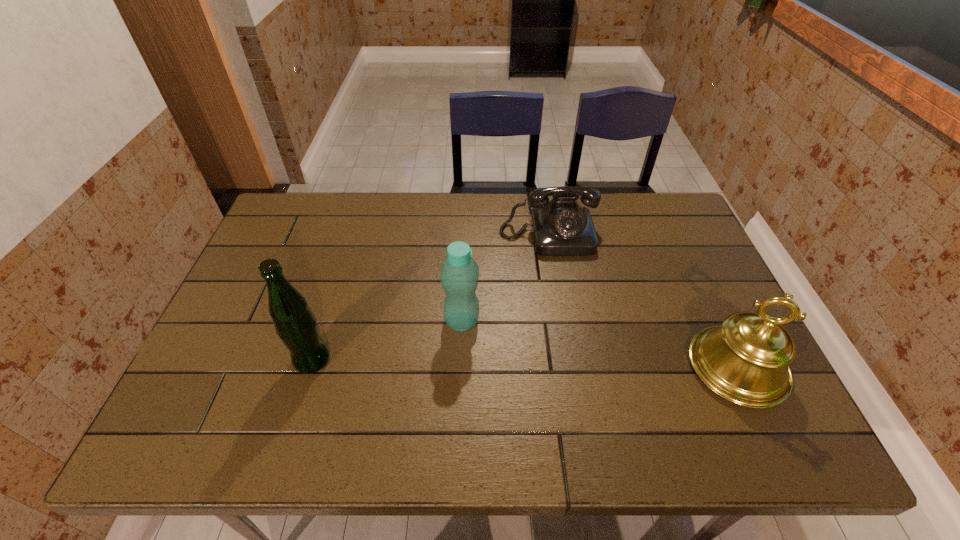
At what (x,y) coordinates should I click in order to perform the action: click on vacant space at the near edge of the desktop. Please return your answer as a coordinate pair (x, y). Looking at the image, I should click on (311, 373).

The image size is (960, 540). I want to click on free space at the left edge of the desktop, so click(245, 302).

In the image, there is a desktop. Identify the location of free space at the right edge. Image resolution: width=960 pixels, height=540 pixels. (698, 256).

At what (x,y) coordinates should I click in order to perform the action: click on free space at the near left corner. Please return your answer as a coordinate pair (x, y). Looking at the image, I should click on (252, 396).

I want to click on free space at the far right corner of the desktop, so click(641, 223).

I want to click on vacant space that's between the third object from left to right and the second object from left to right, so click(505, 278).

Identify the location of vacant area that lies between the bell and the farthest object. The image size is (960, 540). (642, 301).

The width and height of the screenshot is (960, 540). Identify the location of vacant space that's between the shortest object and the water bottle. (505, 278).

I want to click on vacant space in between the third object from right to left and the bell, so click(x=600, y=344).

This screenshot has height=540, width=960. I want to click on free space between the water bottle and the farthest object, so click(505, 278).